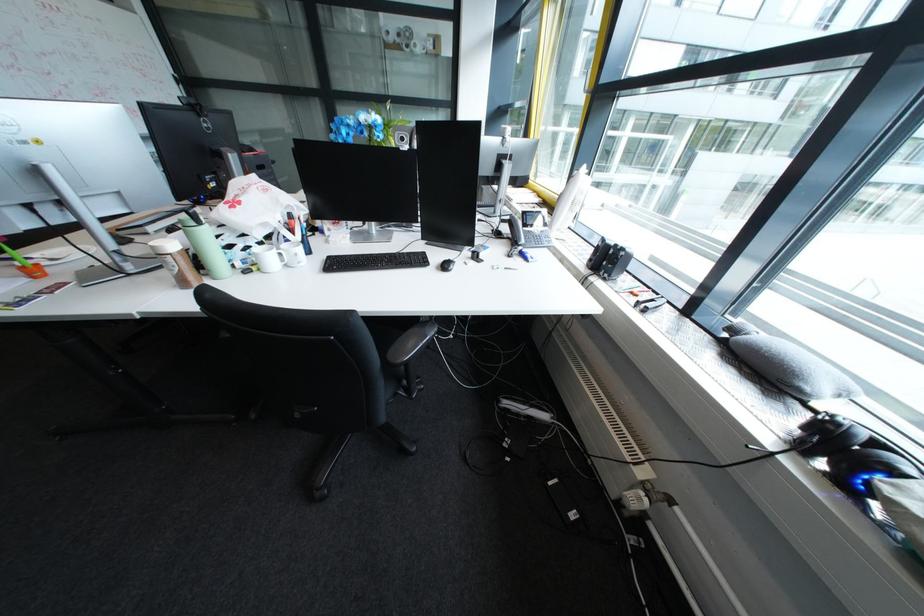
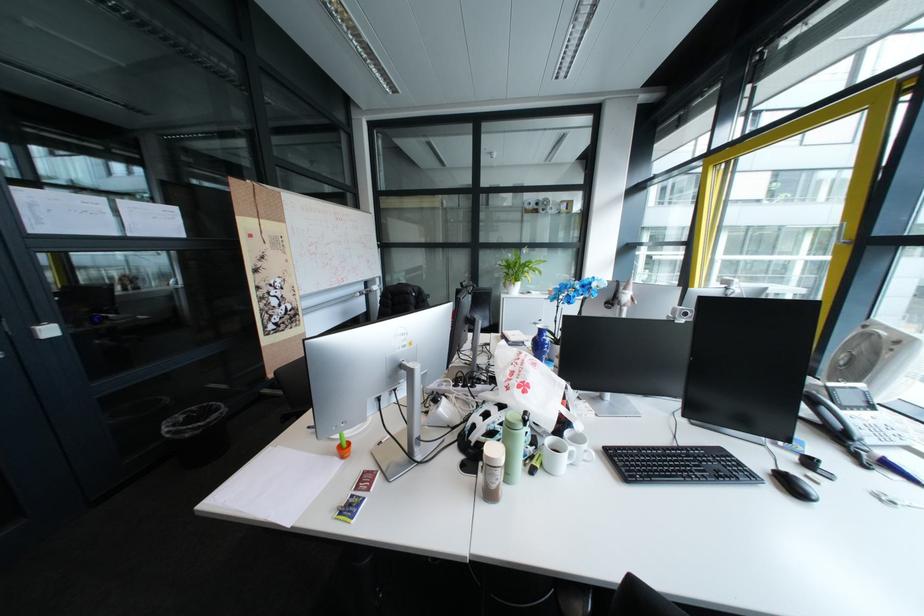
Where in the second image is the point corresponding to point (28, 277) from the first image?

(341, 454)